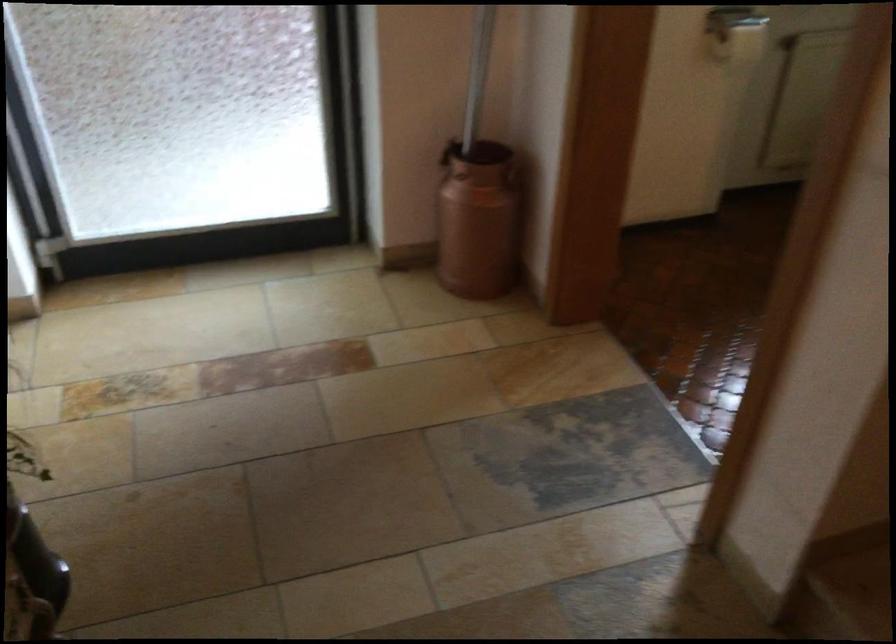
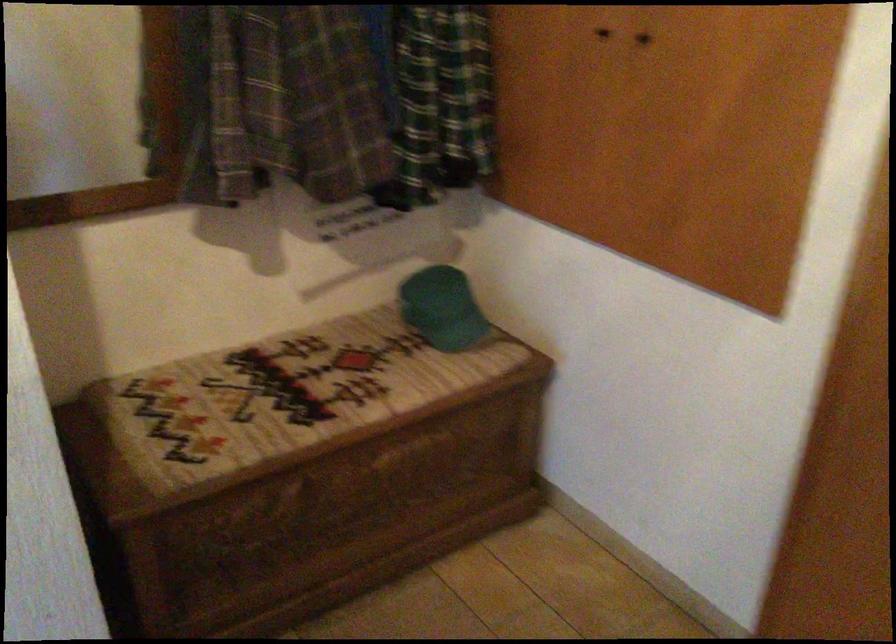
How did the camera likely rotate?

The rotation direction of the camera is right-down.